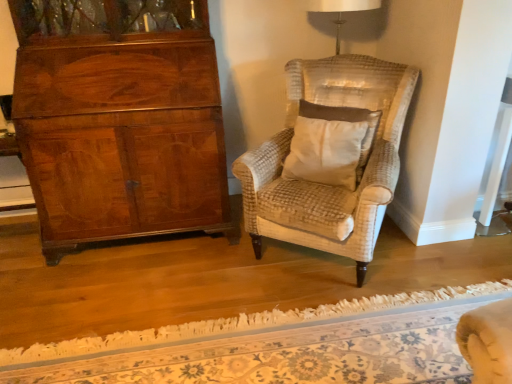
What do you see at coordinates (347, 121) in the screenshot? I see `beige fabric pillow at center` at bounding box center [347, 121].

Identify the location of beige fabric pillow at center. (347, 121).

Locate an element on the screen. Image resolution: width=512 pixels, height=384 pixels. beige fabric pillow at center is located at coordinates (347, 121).